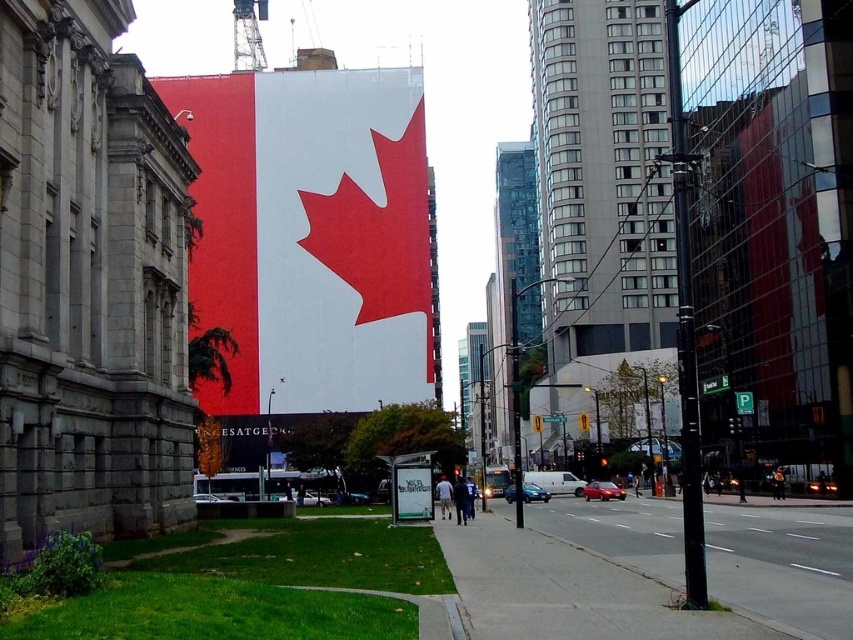
What do you see at coordinates (311, 236) in the screenshot?
I see `matte red and white flag at center` at bounding box center [311, 236].

Which is more to the left, matte red and white flag at center or white matte sign at center?

Positioned to the left is matte red and white flag at center.

At what (x,y) coordinates should I click in order to perform the action: click on matte red and white flag at center. Please return your answer as a coordinate pair (x, y). Image resolution: width=853 pixels, height=640 pixels. Looking at the image, I should click on (311, 236).

Is point (775, 596) positioned in front of point (415, 493)?

Yes, it is in front of point (415, 493).

Between gray asphalt pavement at lower right and white matte sign at center, which one has more height?

With more height is gray asphalt pavement at lower right.

This screenshot has width=853, height=640. What do you see at coordinates (782, 566) in the screenshot?
I see `gray asphalt pavement at lower right` at bounding box center [782, 566].

Image resolution: width=853 pixels, height=640 pixels. What are the coordinates of `gray asphalt pavement at lower right` in the screenshot? It's located at (782, 566).

Who is positioned more to the right, matte red and white flag at center or gray asphalt pavement at lower right?

From the viewer's perspective, gray asphalt pavement at lower right appears more on the right side.

Who is shorter, matte red and white flag at center or gray asphalt pavement at lower right?

With less height is gray asphalt pavement at lower right.

Locate an element on the screen. The width and height of the screenshot is (853, 640). matte red and white flag at center is located at coordinates (311, 236).